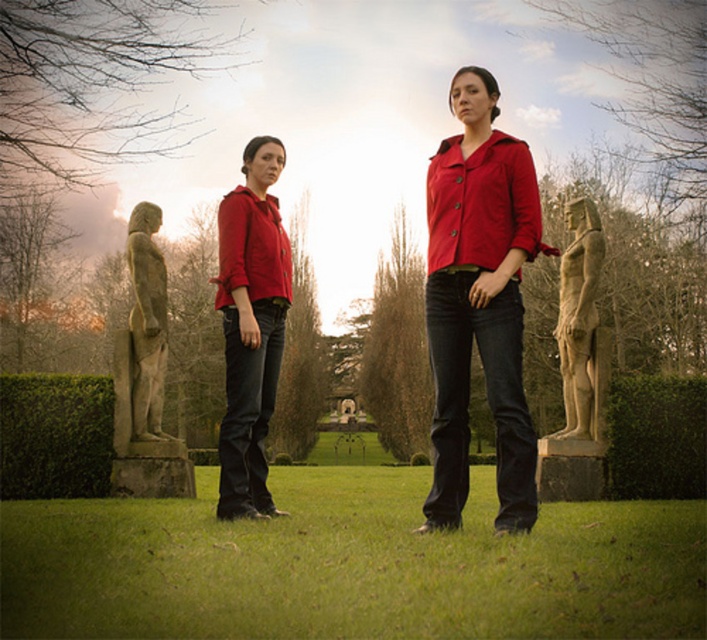
You are standing in a park and see the matte red jacket at center. If you want to reach it within 10 seconds, what is the minimum speed you need to walk towards it?

The matte red jacket at center is 8.38 meters away from viewer. To reach it in 10 seconds, you need to walk at a minimum speed of 0.838 meters per second.

You are standing at the center of the lawn and want to walk directly to the stone statue at left. Which direction should you face to walk straight towards it?

You should face towards the left side of the frame to walk straight towards the stone statue at left, as it is positioned at point (146,376).